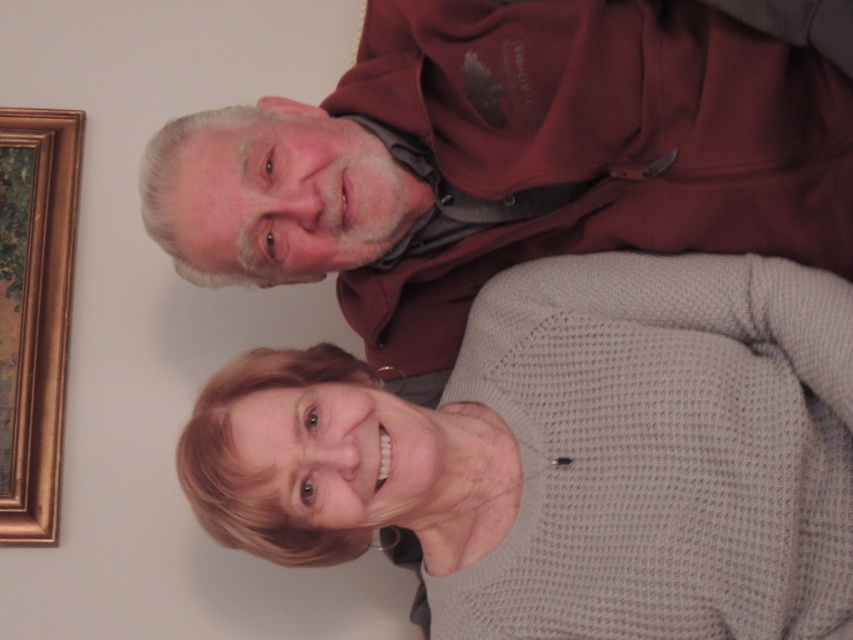
Can you confirm if maroon hoodie at upper center is positioned to the left of gold wooden picture frame at upper left?

Incorrect, maroon hoodie at upper center is not on the left side of gold wooden picture frame at upper left.

Is maroon hoodie at upper center shorter than gold wooden picture frame at upper left?

Yes, maroon hoodie at upper center is shorter than gold wooden picture frame at upper left.

Is point (616, 97) in front of point (22, 467)?

That is True.

The image size is (853, 640). What are the coordinates of `maroon hoodie at upper center` in the screenshot? It's located at (518, 156).

Image resolution: width=853 pixels, height=640 pixels. What do you see at coordinates (570, 454) in the screenshot? I see `gray knitted sweater at center` at bounding box center [570, 454].

Does gray knitted sweater at center have a lesser width compared to gold wooden picture frame at upper left?

No, gray knitted sweater at center is not thinner than gold wooden picture frame at upper left.

Which is behind, point (489, 570) or point (15, 376)?

Point (15, 376)

Where is `gray knitted sweater at center`? gray knitted sweater at center is located at coordinates (570, 454).

Describe the element at coordinates (570, 454) in the screenshot. This screenshot has width=853, height=640. I see `gray knitted sweater at center` at that location.

Which is behind, point (740, 497) or point (527, 80)?

The point (527, 80) is more distant.

The image size is (853, 640). Identify the location of gray knitted sweater at center. (570, 454).

Locate an element on the screen. The image size is (853, 640). gray knitted sweater at center is located at coordinates (570, 454).